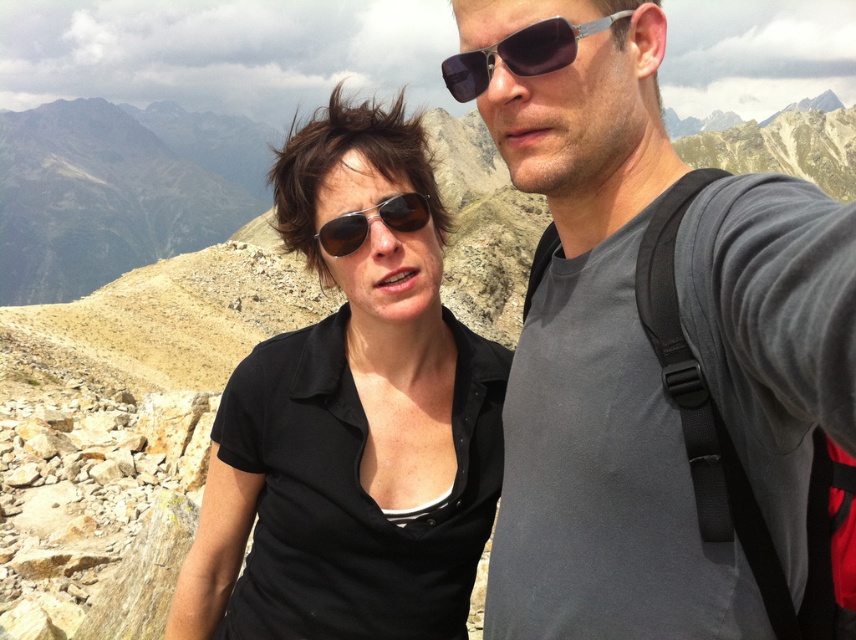
You are a drone operator trying to capture a photo of the two hikers on the mountain trail. You notice two specific points marked as point 1 at coordinates point (467, 80) and point 2 at coordinates point (397, 195). Which point should you focus on to ensure the hikers are in focus if you want to prioritize the closer subject?

Point 1 at coordinates point (467, 80) should be focused on because it is closer to the camera than point 2 at coordinates point (397, 195).